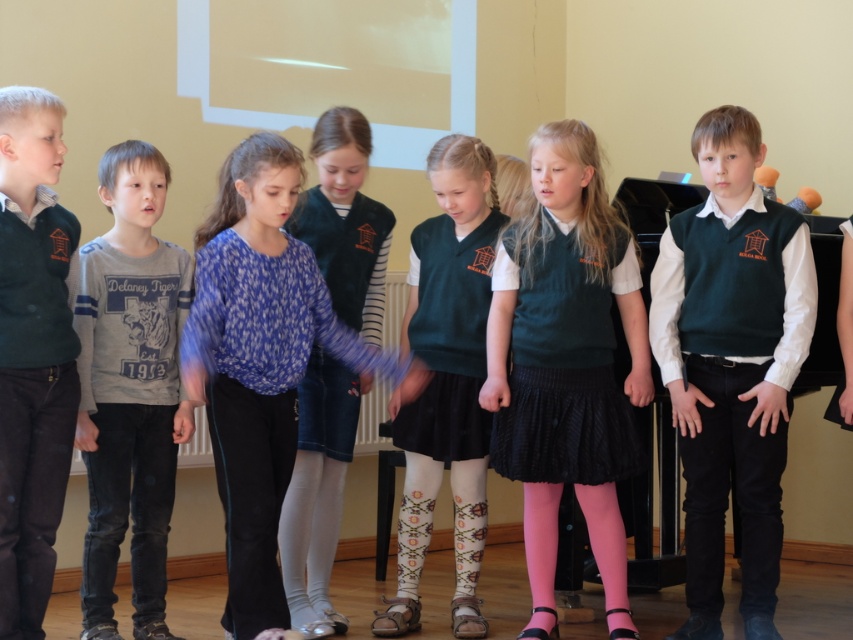
You are a photographer standing in front of the scene. You need to take a photo of the blue printed blouse at center. According to the coordinates given, where should you aim your camera to capture the blouse in the frame?

The blue printed blouse at center is located at coordinates point (260,362), so you should aim your camera at that specific point to capture it in the frame.